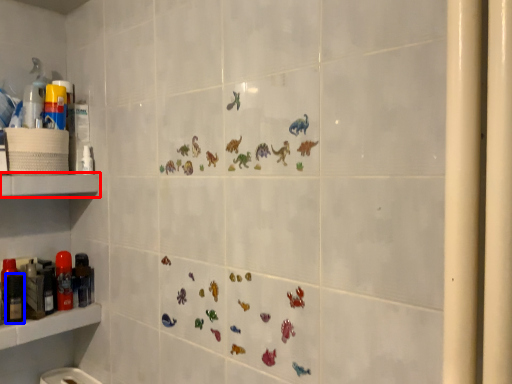
Question: Which object appears closest to the camera in this image, shelf (highlighted by a red box) or toiletry (highlighted by a blue box)?

Choices:
 (A) shelf
 (B) toiletry

Answer: (A)